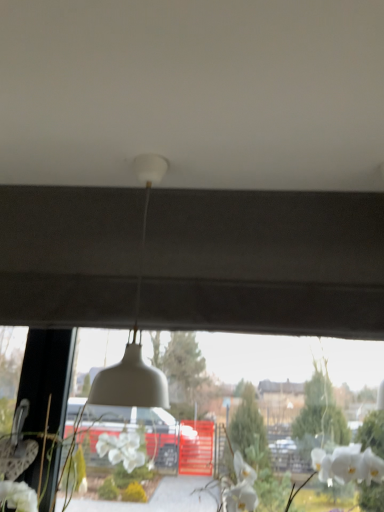
What do you see at coordinates (135, 330) in the screenshot? I see `matte white lampshade at center` at bounding box center [135, 330].

Find the location of a particular element. The height and width of the screenshot is (512, 384). matte white lampshade at center is located at coordinates (135, 330).

Identify the location of matte white lampshade at center. (135, 330).